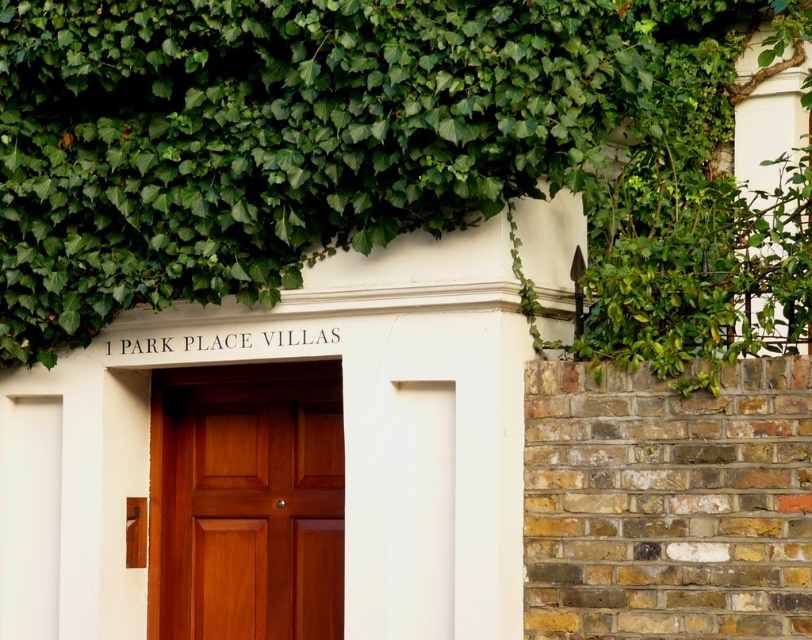
You are standing in front of the entrance of 1 Park Place Villas and notice the green leafy ivy at upper center. Where exactly is the ivy positioned relative to the entrance?

The green leafy ivy at upper center is located at point (x=318, y=132), which places it slightly to the left and above the center of the entrance.

You are standing in front of the entrance of 1 Park Place Villas and want to take a photo of the wooden door. The camera you are using has a focus range of 5 to 10 meters. Is the point at coordinate point (100, 260) within the camera focus range?

The distance of point (100, 260) from the camera is 6.79 meters, which falls within the camera focus range of 5 to 10 meters. Therefore, the point is within range.

You are standing in front of the entrance of 1 Park Place Villas. You see a point marked at coordinates [318,132]. Based on the scene, what is this point likely located on?

The point at [318,132] is on green leafy ivy at upper center.